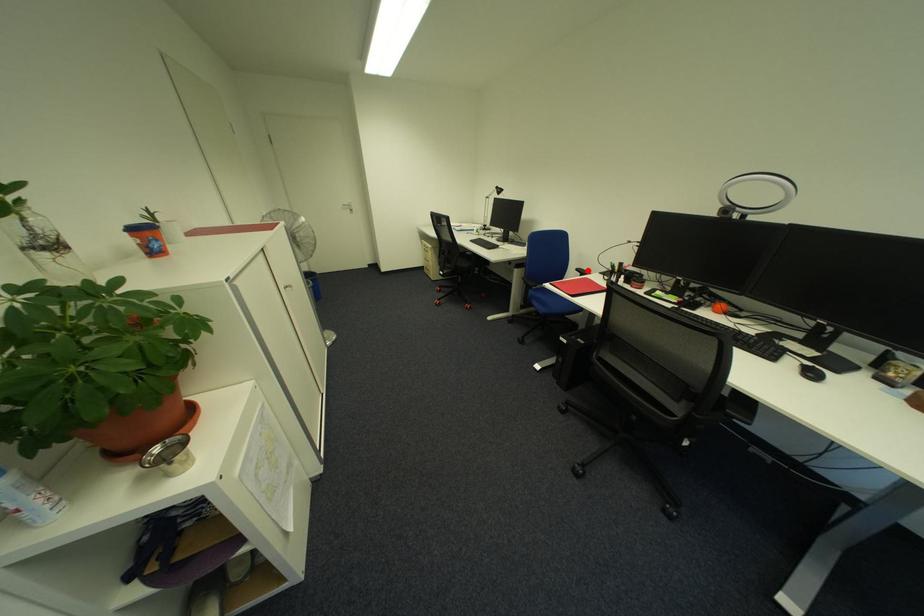
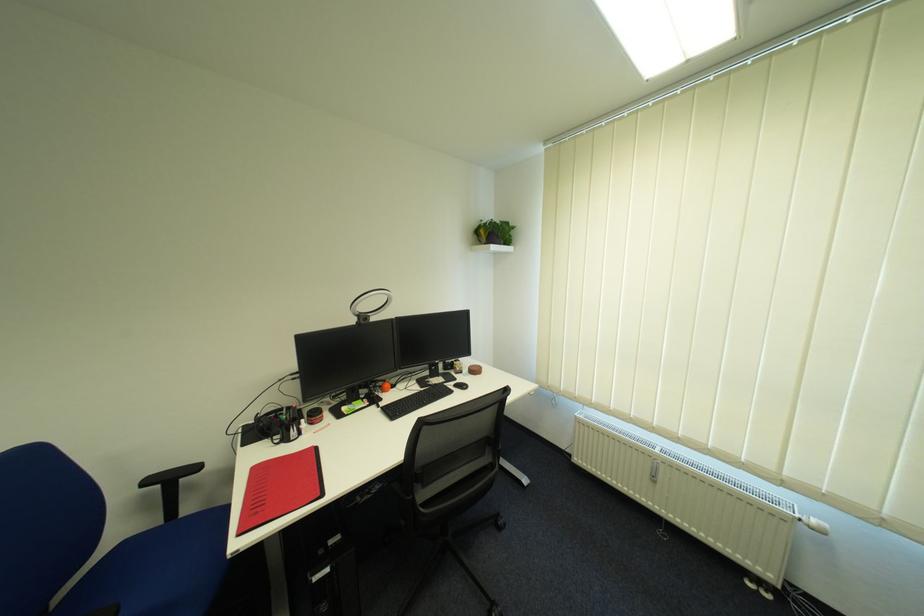
Locate, in the second image, the point that corresponds to the highlighted location in the first image.

(157, 483)